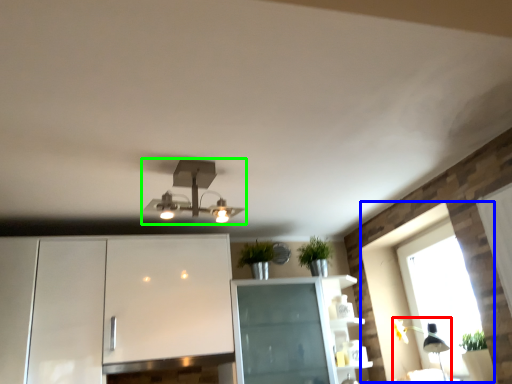
Question: Considering the real-world distances, which object is farthest from light fixture (highlighted by a red box)? window (highlighted by a blue box) or lamp (highlighted by a green box)?

Choices:
 (A) window
 (B) lamp

Answer: (B)